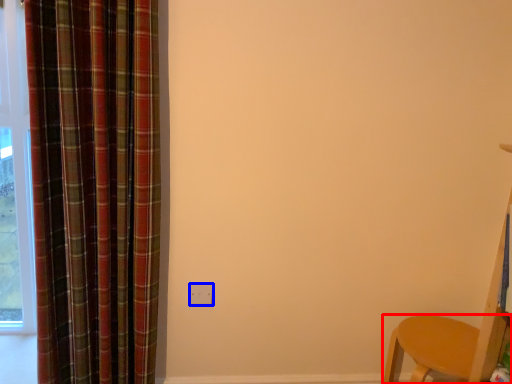
Question: Which of the following is the closest to the observer, furniture (highlighted by a red box) or electric outlet (highlighted by a blue box)?

Choices:
 (A) furniture
 (B) electric outlet

Answer: (A)